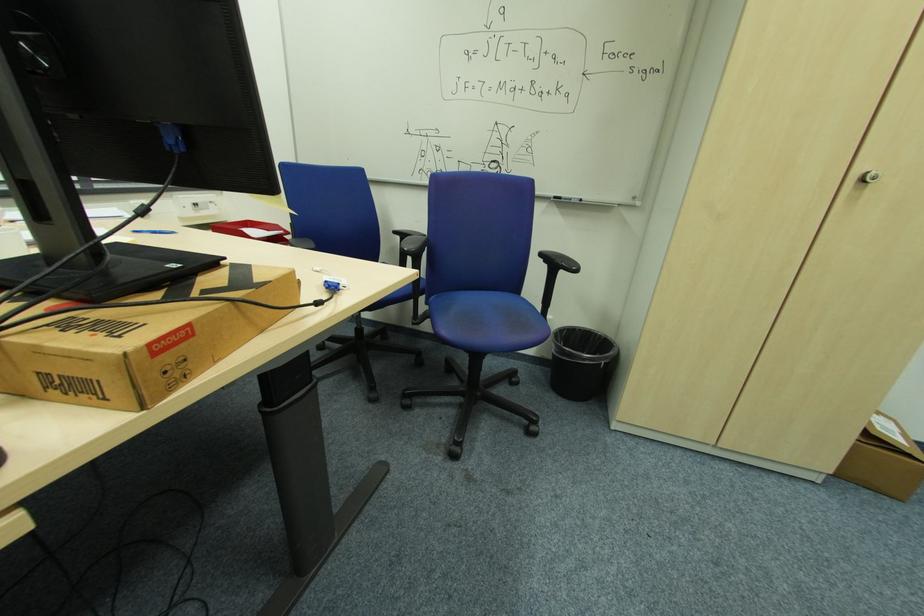
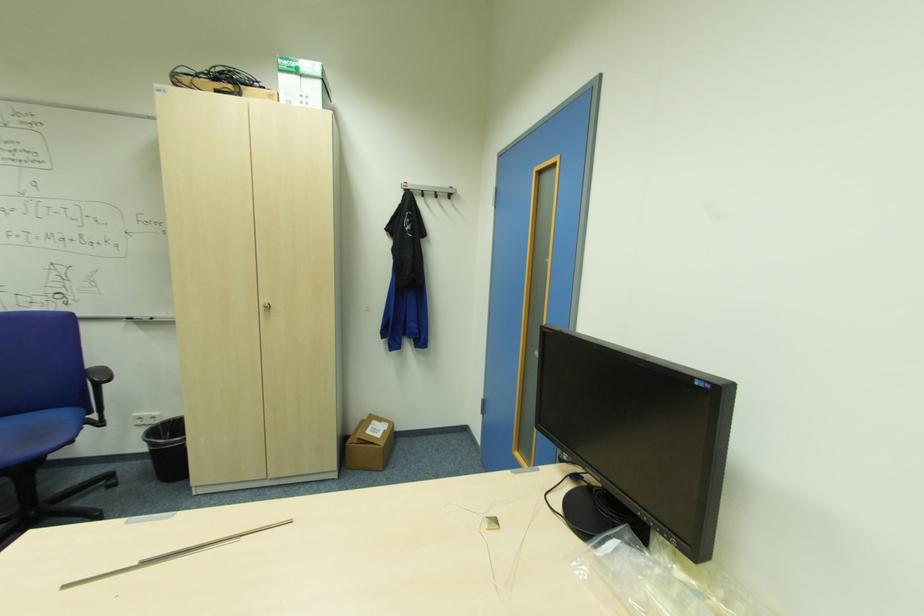
In the second image, find the point that corresponds to pixel 578 270 in the first image.

(110, 381)